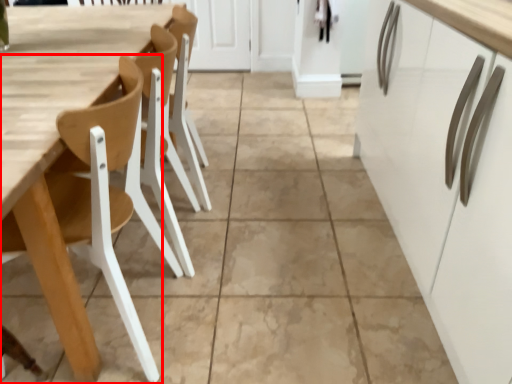
Question: In this image, where is chair (annotated by the red box) located relative to table?

Choices:
 (A) left
 (B) right

Answer: (A)